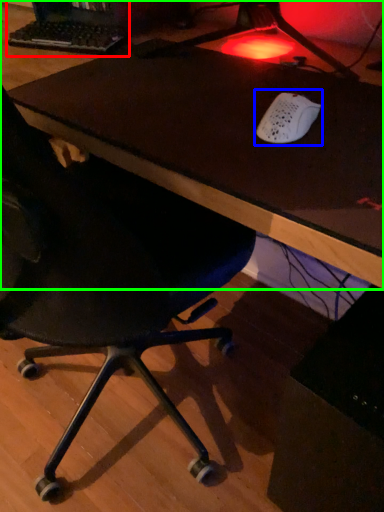
Question: Which object is positioned closest to desktop computer (highlighted by a red box)? Select from mouse (highlighted by a blue box) and table (highlighted by a green box).

Choices:
 (A) mouse
 (B) table

Answer: (B)